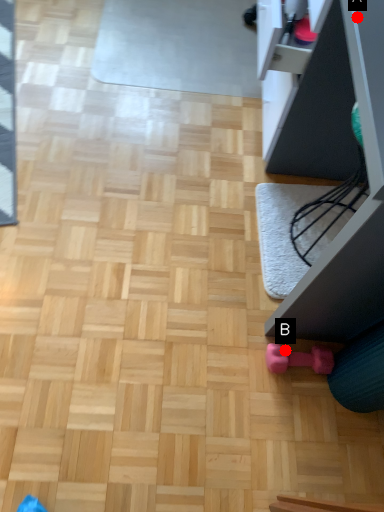
Question: Two points are circled on the image, labeled by A and B beside each circle. Which point is closer to the camera?

Choices:
 (A) A is closer
 (B) B is closer

Answer: (A)